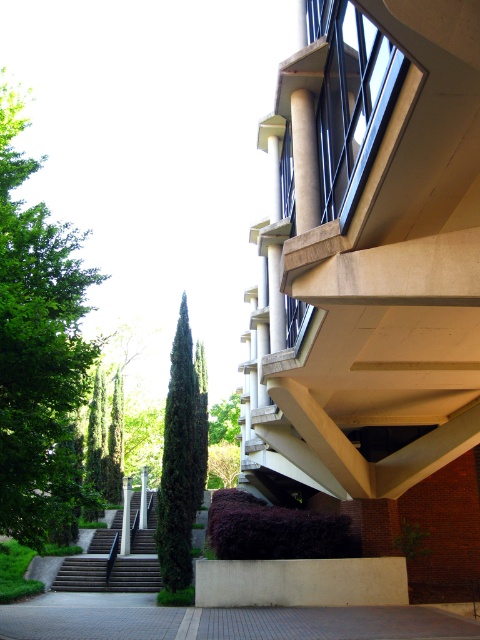
You are a landscape architect planning to install a new pathway. You have a gray brick pavement at lower center and a green textured tree at center. Which object requires more space in the current layout?

The green textured tree at center requires more space in the current layout because it is larger than the gray brick pavement at lower center.

You are a delivery person trying to park your 1.2 meter wide delivery cart near the entrance. The gray brick pavement at lower center and green textured tree at center are in your way. Which one can you use to park your cart?

The gray brick pavement at lower center can be used to park the cart since its width surpasses the green textured tree at center, making it wide enough to accommodate the 1.2 meter wide delivery cart.